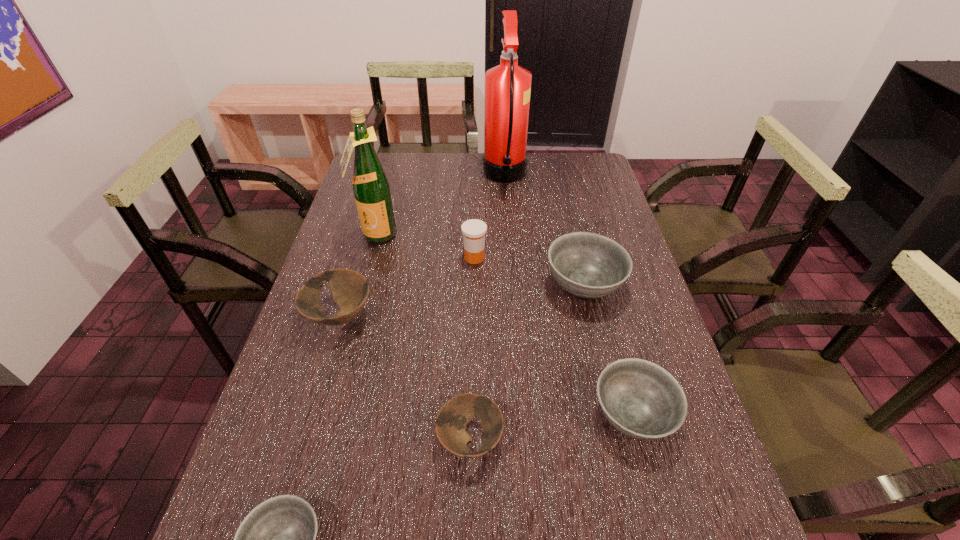
Where is `the third bowl from right to left`? This screenshot has width=960, height=540. the third bowl from right to left is located at coordinates (455, 414).

Find the location of `free location located at the spray nozzle of the red fire extinguisher`. free location located at the spray nozzle of the red fire extinguisher is located at coordinates (399, 177).

The width and height of the screenshot is (960, 540). I want to click on blank area located at the spray nozzle of the red fire extinguisher, so click(410, 177).

The height and width of the screenshot is (540, 960). Identify the location of vacant space situated at the spray nozzle of the red fire extinguisher. (383, 177).

Where is `vacant area situated 0.350m on the front-facing side of the second farthest object`? This screenshot has width=960, height=540. vacant area situated 0.350m on the front-facing side of the second farthest object is located at coordinates (348, 337).

You are a GUI agent. You are given a task and a screenshot of the screen. Output one action in this format:
    pyautogui.click(x=<x>, y=<y>)
    Task: Click on the blank space located on the label of the orange medicine
    This screenshot has width=960, height=540.
    Given the screenshot: What is the action you would take?
    pyautogui.click(x=607, y=258)

The height and width of the screenshot is (540, 960). I want to click on free location located 0.110m on the back of the biggest gray bowl, so click(x=572, y=236).

Locate an element on the screen. The width and height of the screenshot is (960, 540). vacant area located 0.260m on the back of the bigger brown bowl is located at coordinates click(365, 233).

Find the location of a particular element. Image resolution: width=960 pixels, height=540 pixels. vacant space located 0.350m on the left of the second nearest gray bowl is located at coordinates (429, 416).

Find the location of a particular element. Image resolution: width=960 pixels, height=540 pixels. vacant region located on the left of the nearer brown bowl is located at coordinates (389, 439).